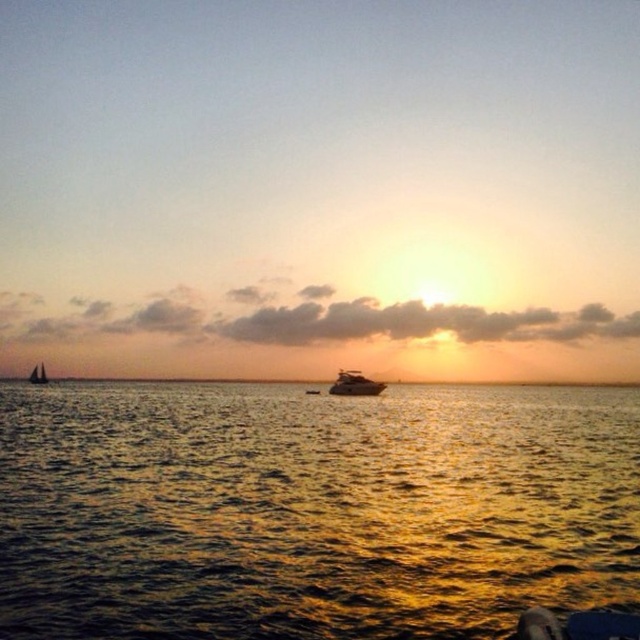
Question: Among these objects, which one is farthest from the camera?

Choices:
 (A) shiny silver yacht at center
 (B) white sailboat at left
 (C) shiny golden water at center

Answer: (B)

Question: Does shiny golden water at center have a larger size compared to white sailboat at left?

Choices:
 (A) yes
 (B) no

Answer: (B)

Question: Is shiny golden water at center to the right of white sailboat at left from the viewer's perspective?

Choices:
 (A) no
 (B) yes

Answer: (B)

Question: Which object appears farthest from the camera in this image?

Choices:
 (A) shiny silver yacht at center
 (B) white sailboat at left

Answer: (B)

Question: Is the position of shiny silver yacht at center less distant than that of white sailboat at left?

Choices:
 (A) no
 (B) yes

Answer: (B)

Question: Estimate the real-world distances between objects in this image. Which object is closer to the shiny golden water at center?

Choices:
 (A) shiny silver yacht at center
 (B) white sailboat at left

Answer: (A)